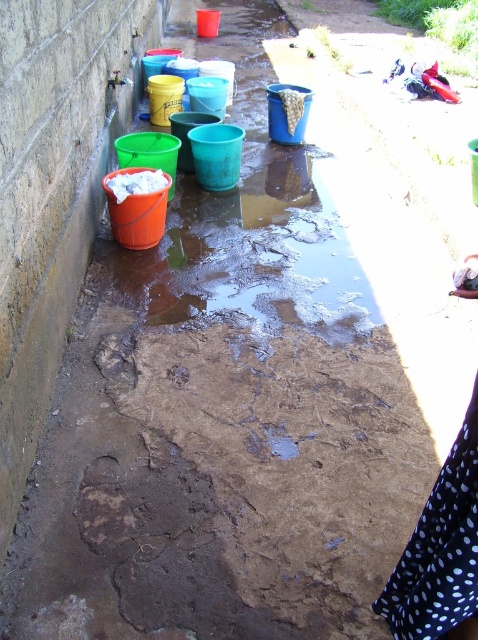
Is shiny plastic buckets at left below black dotted fabric at lower right?

Actually, shiny plastic buckets at left is above black dotted fabric at lower right.

Identify the location of shiny plastic buckets at left. (249, 220).

Between point (224, 202) and point (468, 472), which one is positioned in front?

Point (468, 472) is in front.

Identify the location of shiny plastic buckets at left. click(249, 220).